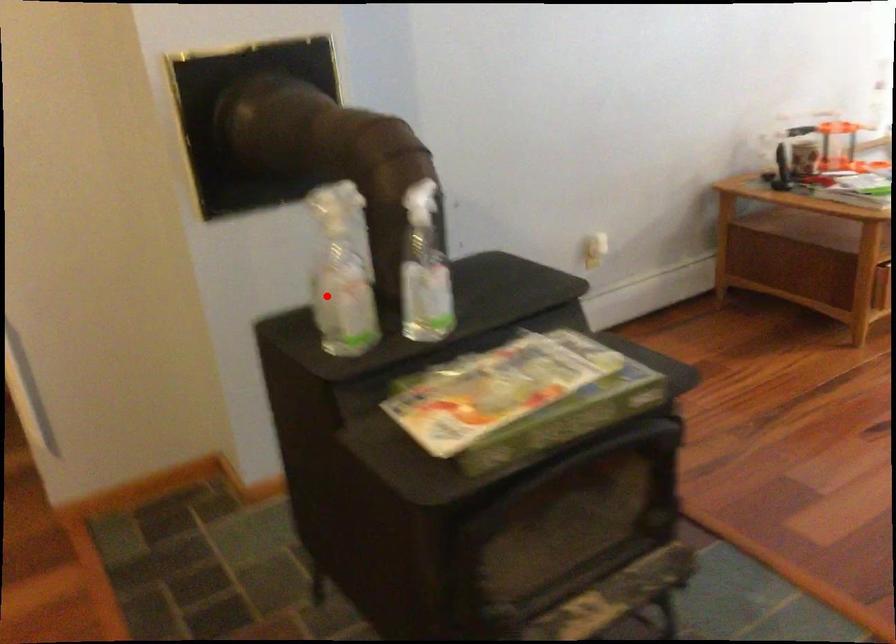
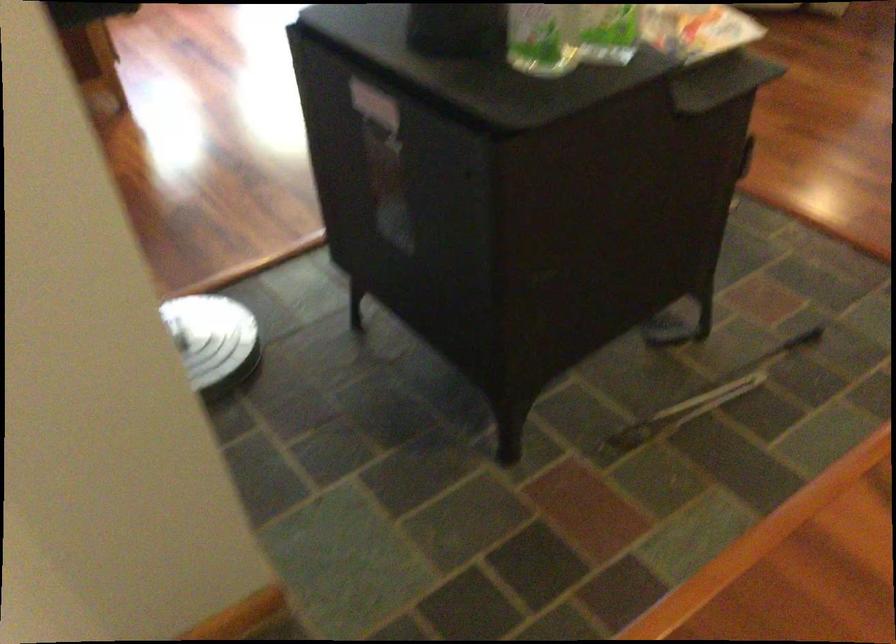
Where in the second image is the point corresponding to the highlighted location from the first image?

(541, 38)